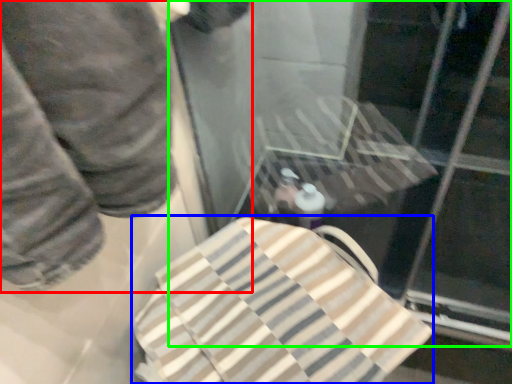
Question: Based on their relative distances, which object is farther from person (highlighted by a red box)? Choose from beach towel (highlighted by a blue box) and glass door (highlighted by a green box).

Choices:
 (A) beach towel
 (B) glass door

Answer: (B)